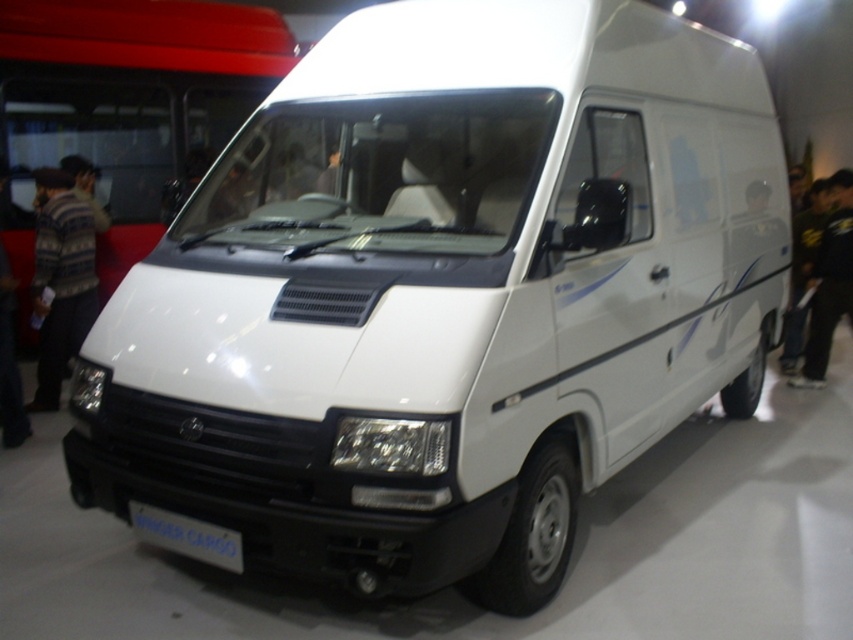
Is striped sweater at left to the right of black fabric pants at right from the viewer's perspective?

No, striped sweater at left is not to the right of black fabric pants at right.

Who is shorter, striped sweater at left or black fabric pants at right?

Standing shorter between the two is striped sweater at left.

Does point (61, 177) come in front of point (850, 184)?

Yes, point (61, 177) is closer to viewer.

The image size is (853, 640). Find the location of `striped sweater at left`. striped sweater at left is located at coordinates (61, 278).